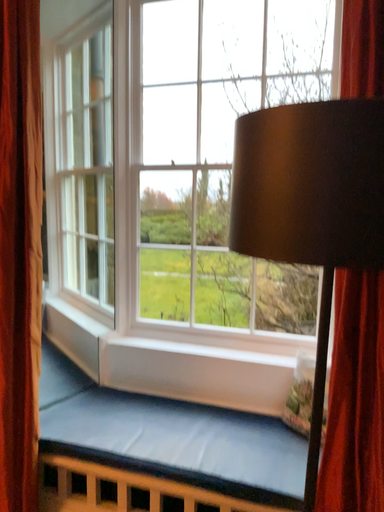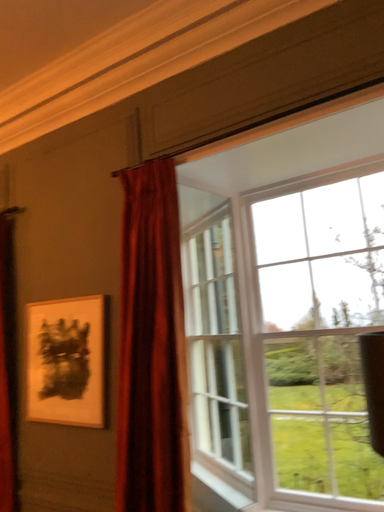
Question: Which way did the camera rotate in the video?

Choices:
 (A) rotated right
 (B) rotated left

Answer: (B)